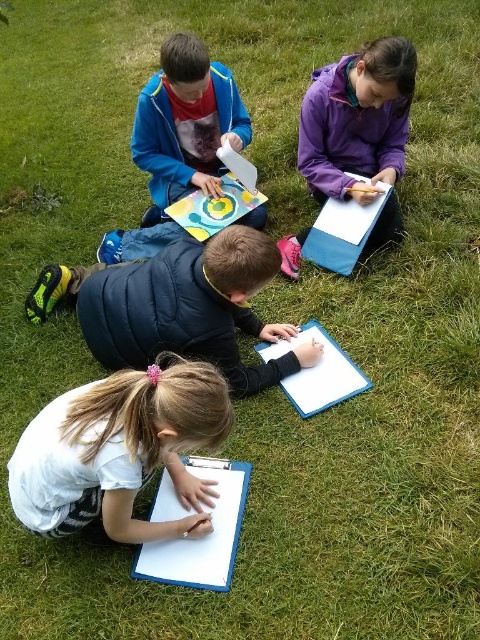
Question: Can you confirm if black matte jacket at center is smaller than purple fleece jacket at upper right?

Choices:
 (A) yes
 (B) no

Answer: (A)

Question: Which point is farther from the camera taking this photo?

Choices:
 (A) (152, 275)
 (B) (348, 189)
 (C) (212, 403)
 (D) (219, 116)

Answer: (D)

Question: Which point is farther to the camera?

Choices:
 (A) matte blue jacket at upper center
 (B) white paper at lower left
 (C) purple fleece jacket at upper right
 (D) black matte jacket at center

Answer: (A)

Question: Does black matte jacket at center appear over matte blue jacket at upper center?

Choices:
 (A) yes
 (B) no

Answer: (B)

Question: Which of these objects is positioned closest to the purple fleece jacket at upper right?

Choices:
 (A) white paper at lower left
 (B) black matte jacket at center

Answer: (B)

Question: Does black matte jacket at center have a greater width compared to matte blue jacket at upper center?

Choices:
 (A) no
 (B) yes

Answer: (B)